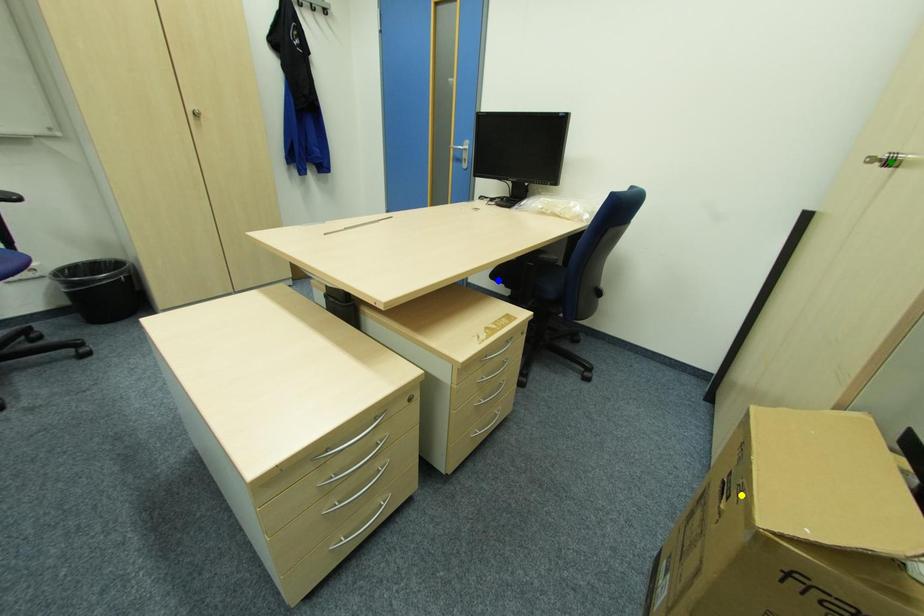
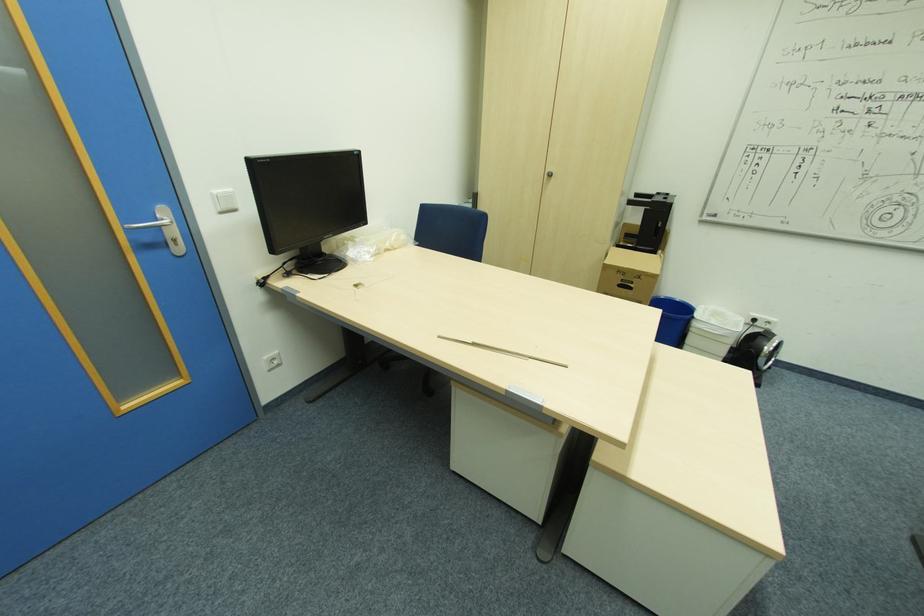
I am providing you with two images of the same scene from different viewpoints. Three points are marked in image1. Which point corresponds to a part or object that is occluded in image2?In image1, three points are marked. Which of them correspond to a part or object that is occluded in image2?Among the three points shown in image1, which one corresponds to a part or object that is no longer visible due to occlusion in image2?

blue point cannot be seen in image2.